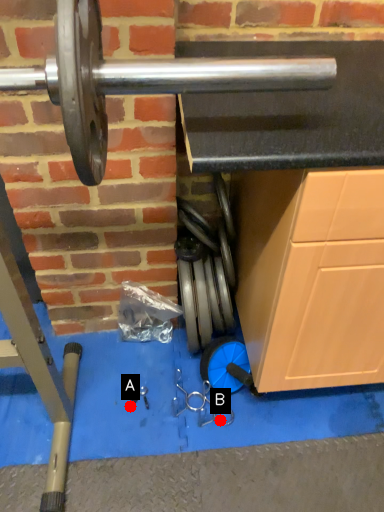
Question: Two points are circled on the image, labeled by A and B beside each circle. Which point is farther from the camera taking this photo?

Choices:
 (A) A is further
 (B) B is further

Answer: (A)